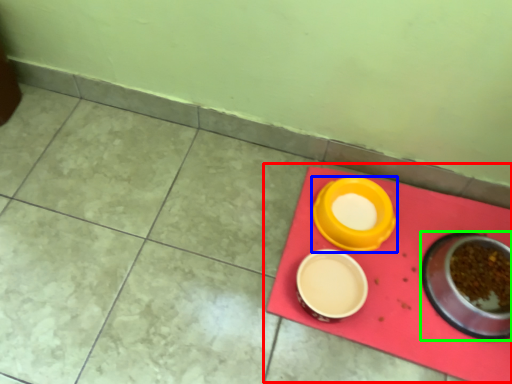
Question: Considering the real-world distances, which object is closest to table (highlighted by a red box)? tableware (highlighted by a blue box) or tableware (highlighted by a green box).

Choices:
 (A) tableware
 (B) tableware

Answer: (B)